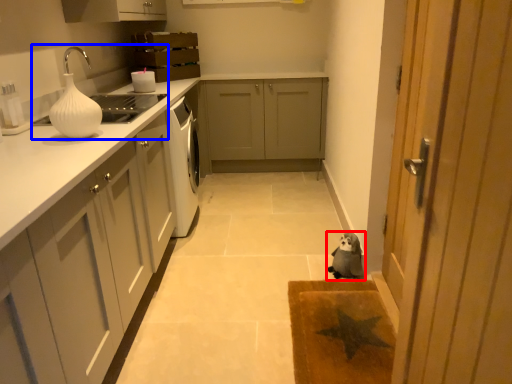
Question: Which point is further to the camera, dog (highlighted by a red box) or sink (highlighted by a blue box)?

Choices:
 (A) dog
 (B) sink

Answer: (A)